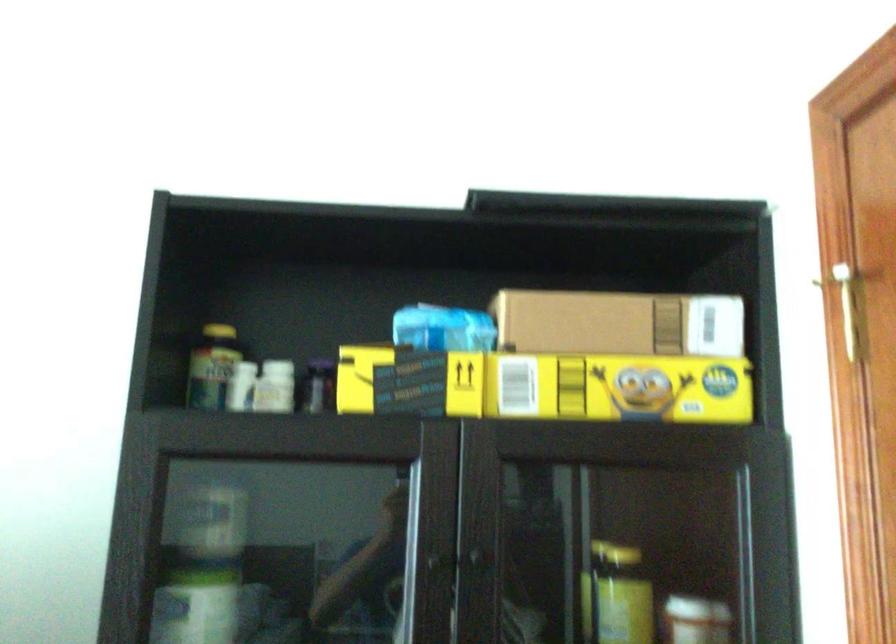
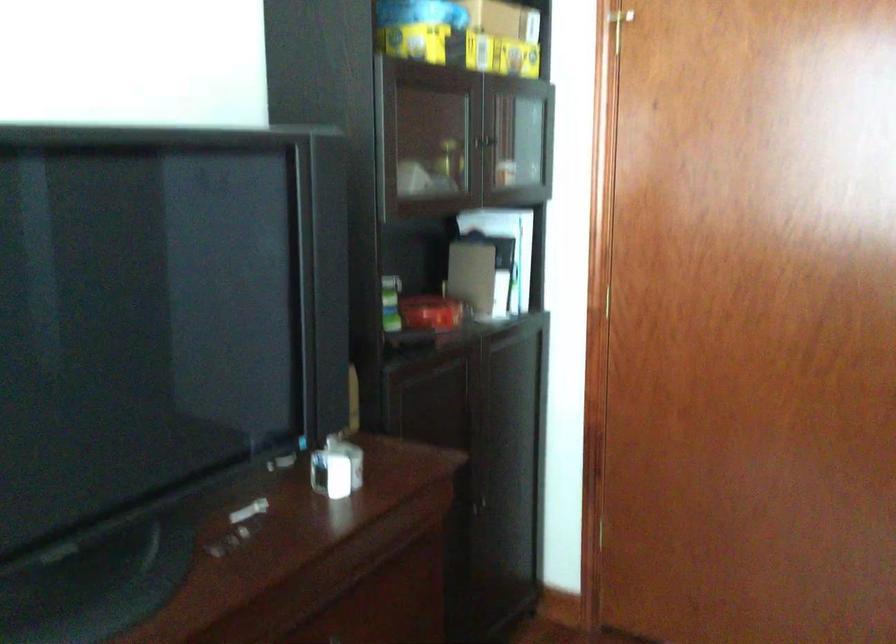
The point at (x=348, y=389) is marked in the first image. Where is the corresponding point in the second image?

(415, 41)